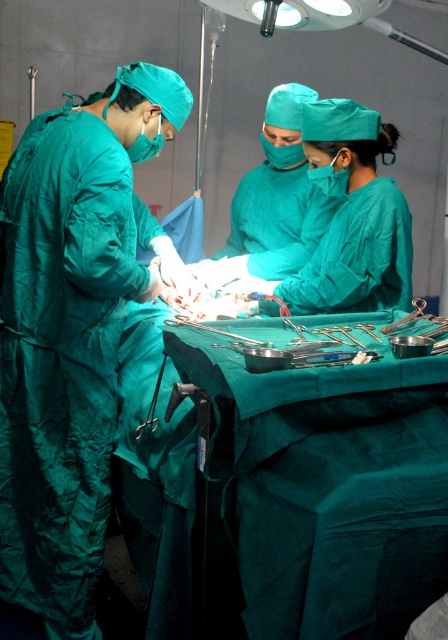
Can you confirm if teal matte/green surgical gown at left is positioned to the right of metallic silver surgical instruments at center?

No, teal matte/green surgical gown at left is not to the right of metallic silver surgical instruments at center.

Does point (115, 353) come in front of point (173, 317)?

Yes, point (115, 353) is closer to viewer.

You are a GUI agent. You are given a task and a screenshot of the screen. Output one action in this format:
    pyautogui.click(x=<x>, y=<y>)
    Task: Click on the teal matte/green surgical gown at left
    This screenshot has height=640, width=448.
    Given the screenshot: What is the action you would take?
    pyautogui.click(x=73, y=330)